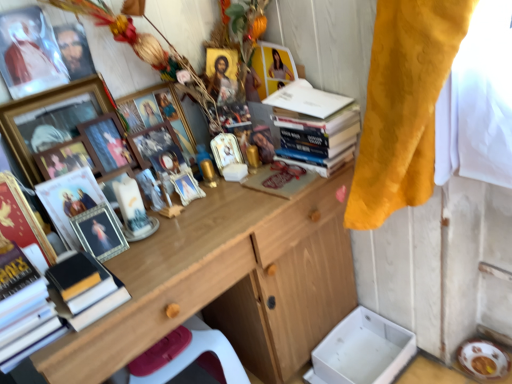
You are a GUI agent. You are given a task and a screenshot of the screen. Output one action in this format:
    pyautogui.click(x=<x>, y=<y>)
    Task: Click on the free space between metallic gold picture frame at center, the first picture frame positioned from the right, and matte brown book at center, arranged as the first magazine when viewed from the right
    This screenshot has height=384, width=512.
    Given the screenshot: What is the action you would take?
    pyautogui.click(x=245, y=178)